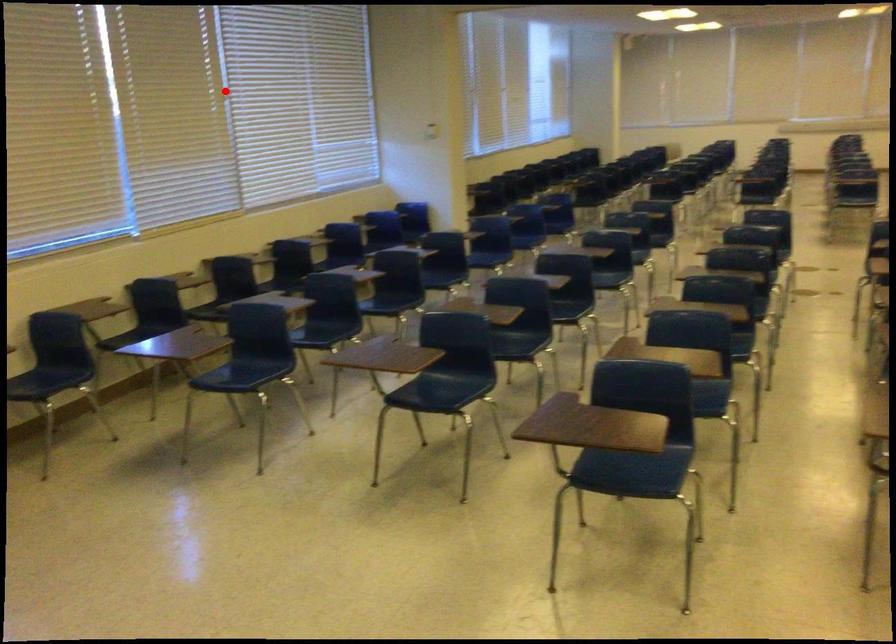
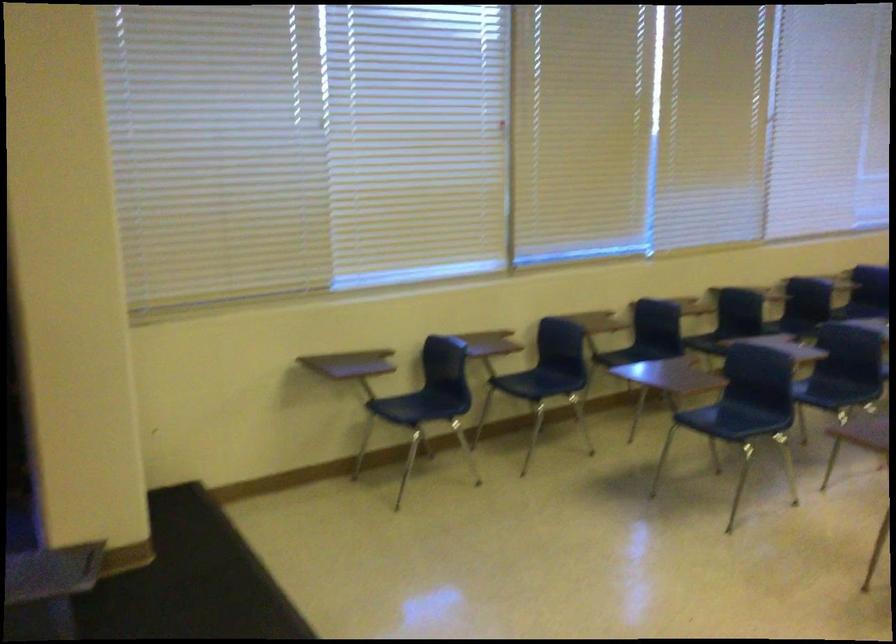
Find the pixel in the second image that matches the highlighted location in the first image.

(771, 116)